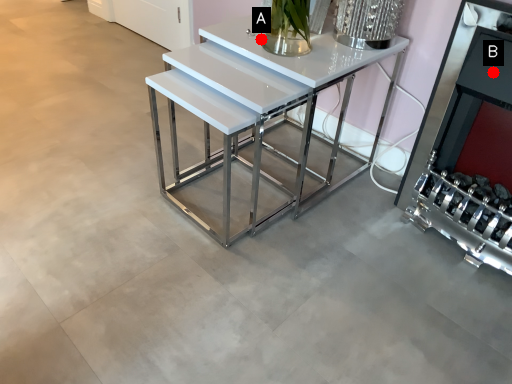
Question: Two points are circled on the image, labeled by A and B beside each circle. Among these points, which one is farthest from the camera?

Choices:
 (A) A is further
 (B) B is further

Answer: (A)